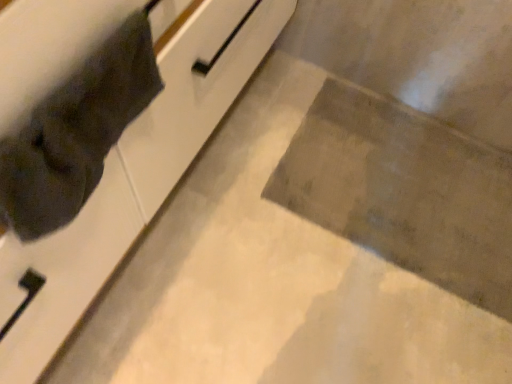
Question: In the image, is dark fabric cat at left on the left side or the right side of white glossy cabinet at upper left?

Choices:
 (A) right
 (B) left

Answer: (A)

Question: From the image's perspective, is dark fabric cat at left located above or below white glossy cabinet at upper left?

Choices:
 (A) above
 (B) below

Answer: (B)

Question: Is dark fabric cat at left in front of or behind white glossy cabinet at upper left in the image?

Choices:
 (A) behind
 (B) front

Answer: (A)

Question: From a real-world perspective, is white glossy cabinet at upper left above or below dark fabric cat at left?

Choices:
 (A) below
 (B) above

Answer: (A)

Question: From the image's perspective, relative to dark fabric cat at left, is white glossy cabinet at upper left above or below?

Choices:
 (A) below
 (B) above

Answer: (B)

Question: Based on their positions, is white glossy cabinet at upper left located to the left or right of dark fabric cat at left?

Choices:
 (A) right
 (B) left

Answer: (B)

Question: Relative to dark fabric cat at left, is white glossy cabinet at upper left in front or behind?

Choices:
 (A) front
 (B) behind

Answer: (A)